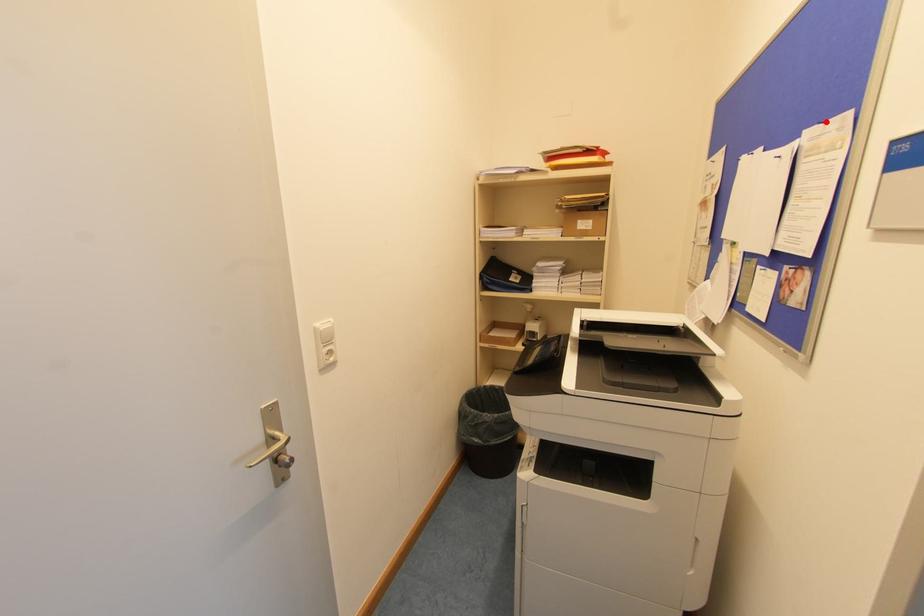
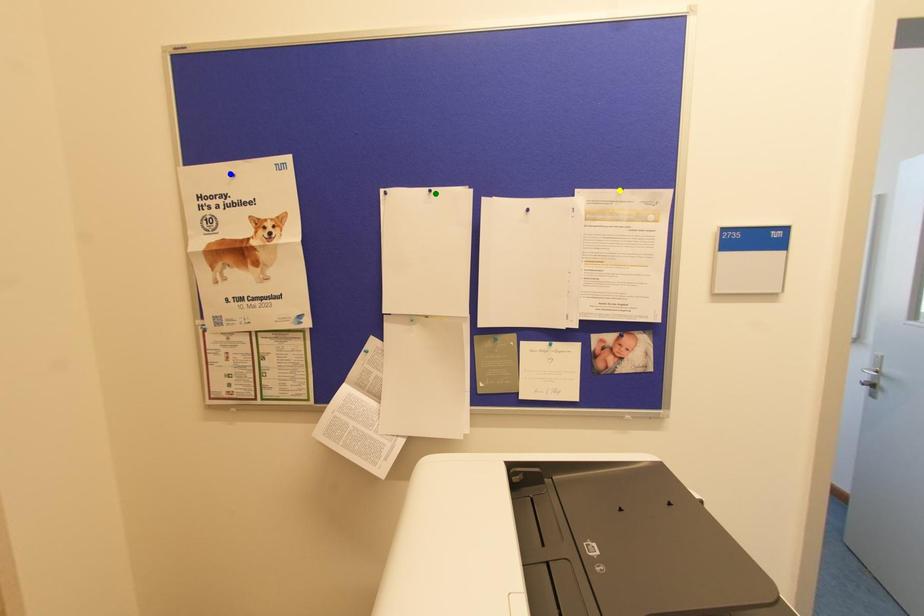
Question: I am providing you with two images of the same scene from different viewpoints. A red point is marked on the first image. You are given multiple points on the second image. Can you choose the point in image 2 that corresponds to the point in image 1?

Choices:
 (A) blue point
 (B) green point
 (C) yellow point

Answer: (C)